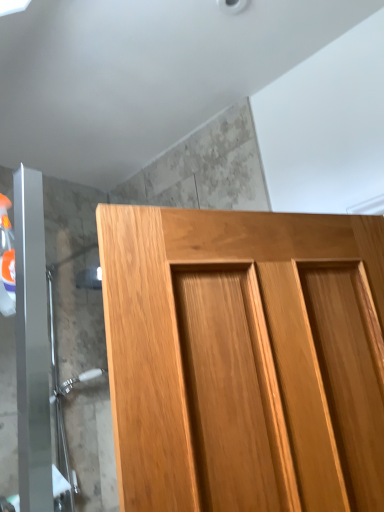
This screenshot has width=384, height=512. What do you see at coordinates (244, 358) in the screenshot?
I see `light brown wood door at center` at bounding box center [244, 358].

Locate an element on the screen. light brown wood door at center is located at coordinates (244, 358).

Consider the image. What is the approximate width of light brown wood door at center?

light brown wood door at center is 5.73 inches in width.

You are a GUI agent. You are given a task and a screenshot of the screen. Output one action in this format:
    pyautogui.click(x=<x>, y=<y>)
    Task: Click on the satin nickel shower door at lower left
    The image size is (384, 512).
    Given the screenshot: What is the action you would take?
    pyautogui.click(x=63, y=393)

Measure the distance between satin nickel shower door at lower left and camera.

They are 4.74 feet apart.

This screenshot has height=512, width=384. What do you see at coordinates (63, 393) in the screenshot?
I see `satin nickel shower door at lower left` at bounding box center [63, 393].

This screenshot has width=384, height=512. What are the coordinates of `light brown wood door at center` in the screenshot? It's located at (244, 358).

Which is more to the left, light brown wood door at center or satin nickel shower door at lower left?

satin nickel shower door at lower left.

Is light brown wood door at center further to the viewer compared to satin nickel shower door at lower left?

No, it is not.

Is point (127, 211) closer to viewer compared to point (78, 484)?

That is True.

From the image's perspective, is light brown wood door at center under satin nickel shower door at lower left?

No.

From a real-world perspective, is light brown wood door at center above or below satin nickel shower door at lower left?

light brown wood door at center is situated lower than satin nickel shower door at lower left in the real world.

Considering the sizes of objects light brown wood door at center and satin nickel shower door at lower left in the image provided, who is thinner, light brown wood door at center or satin nickel shower door at lower left?

With smaller width is satin nickel shower door at lower left.

From their relative heights in the image, would you say light brown wood door at center is taller or shorter than satin nickel shower door at lower left?

In the image, light brown wood door at center appears to be shorter than satin nickel shower door at lower left.

Can you confirm if light brown wood door at center is bigger than satin nickel shower door at lower left?

Indeed, light brown wood door at center has a larger size compared to satin nickel shower door at lower left.

Is light brown wood door at center completely or partially outside of satin nickel shower door at lower left?

That's correct, light brown wood door at center is outside of satin nickel shower door at lower left.

Are light brown wood door at center and satin nickel shower door at lower left far apart?

No, light brown wood door at center is in close proximity to satin nickel shower door at lower left.

Does light brown wood door at center turn towards satin nickel shower door at lower left?

No, light brown wood door at center is not facing towards satin nickel shower door at lower left.

What's the angular difference between light brown wood door at center and satin nickel shower door at lower left's facing directions?

They differ by 21.1 degrees in their facing directions.

The image size is (384, 512). In order to click on shower door that appears on the left of light brown wood door at center in this screenshot , I will do `click(63, 393)`.

Considering the relative positions of satin nickel shower door at lower left and light brown wood door at center in the image provided, is satin nickel shower door at lower left to the left or to the right of light brown wood door at center?

Clearly, satin nickel shower door at lower left is on the left of light brown wood door at center in the image.

Does satin nickel shower door at lower left lie behind light brown wood door at center?

Yes, satin nickel shower door at lower left is further from the viewer.

Is point (57, 342) closer or farther from the camera than point (198, 260)?

Point (57, 342) is farther from the camera than point (198, 260).

From the image's perspective, is satin nickel shower door at lower left positioned above or below light brown wood door at center?

satin nickel shower door at lower left is below light brown wood door at center.

From a real-world perspective, is satin nickel shower door at lower left positioned above or below light brown wood door at center?

Clearly, from a real-world perspective, satin nickel shower door at lower left is above light brown wood door at center.

Does satin nickel shower door at lower left have a greater width compared to light brown wood door at center?

No.

Can you confirm if satin nickel shower door at lower left is shorter than light brown wood door at center?

No, satin nickel shower door at lower left is not shorter than light brown wood door at center.

Between satin nickel shower door at lower left and light brown wood door at center, which one has smaller size?

Smaller between the two is satin nickel shower door at lower left.

Is satin nickel shower door at lower left inside the boundaries of light brown wood door at center, or outside?

satin nickel shower door at lower left lies outside light brown wood door at center.

Is satin nickel shower door at lower left directly adjacent to light brown wood door at center?

satin nickel shower door at lower left is not next to light brown wood door at center, and they're not touching.

Could you tell me if satin nickel shower door at lower left is turned towards light brown wood door at center?

Yes, satin nickel shower door at lower left is facing light brown wood door at center.

What's the angular difference between satin nickel shower door at lower left and light brown wood door at center's facing directions?

They differ by 21.1 degrees in their facing directions.

How much distance is there between satin nickel shower door at lower left and light brown wood door at center?

satin nickel shower door at lower left is 37.96 inches away from light brown wood door at center.

I want to click on door located on the right of satin nickel shower door at lower left, so (244, 358).

Find the location of `shower door that is behind the light brown wood door at center`. shower door that is behind the light brown wood door at center is located at coordinates tap(63, 393).

This screenshot has height=512, width=384. I want to click on shower door above the light brown wood door at center (from a real-world perspective), so click(63, 393).